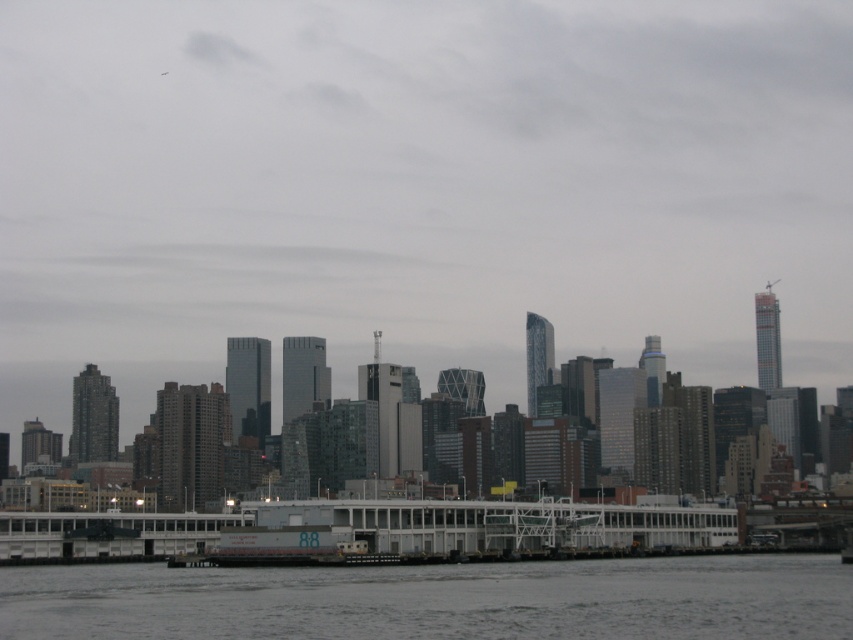
Does gray concrete river at lower center have a lesser width compared to white matte boat at center?

No.

Is point (799, 624) behind point (532, 515)?

No.

Measure the distance between gray concrete river at lower center and camera.

1308.56 feet

Locate an element on the screen. The image size is (853, 640). gray concrete river at lower center is located at coordinates (438, 600).